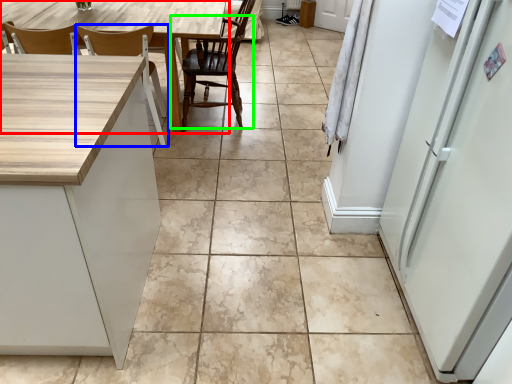
Question: Which object is positioned farthest from table (highlighted by a red box)? Select from chair (highlighted by a blue box) and chair (highlighted by a green box).

Choices:
 (A) chair
 (B) chair

Answer: (B)